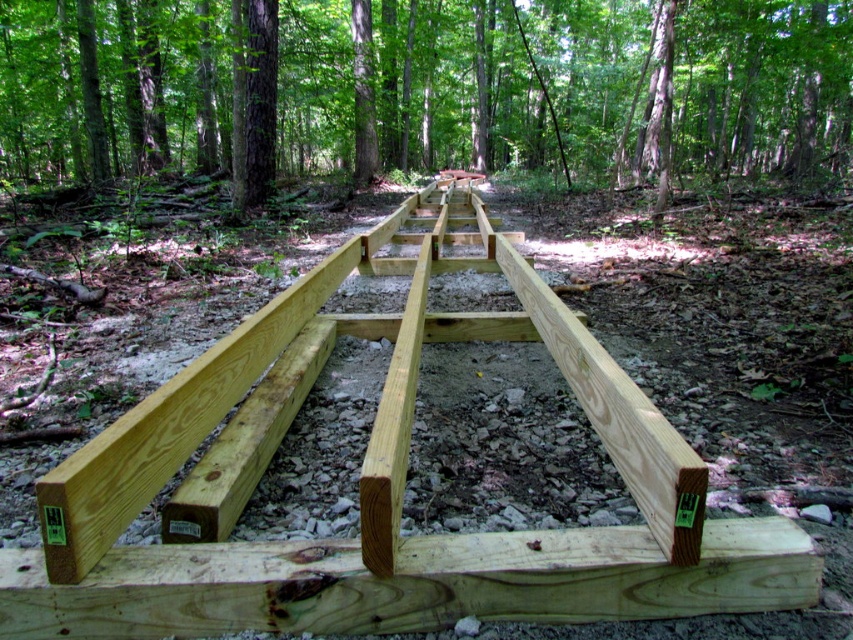
Who is shorter, green wood planks at center or natural wood rail at center?

natural wood rail at center is shorter.

What do you see at coordinates (428, 88) in the screenshot? The height and width of the screenshot is (640, 853). I see `green wood planks at center` at bounding box center [428, 88].

I want to click on green wood planks at center, so click(x=428, y=88).